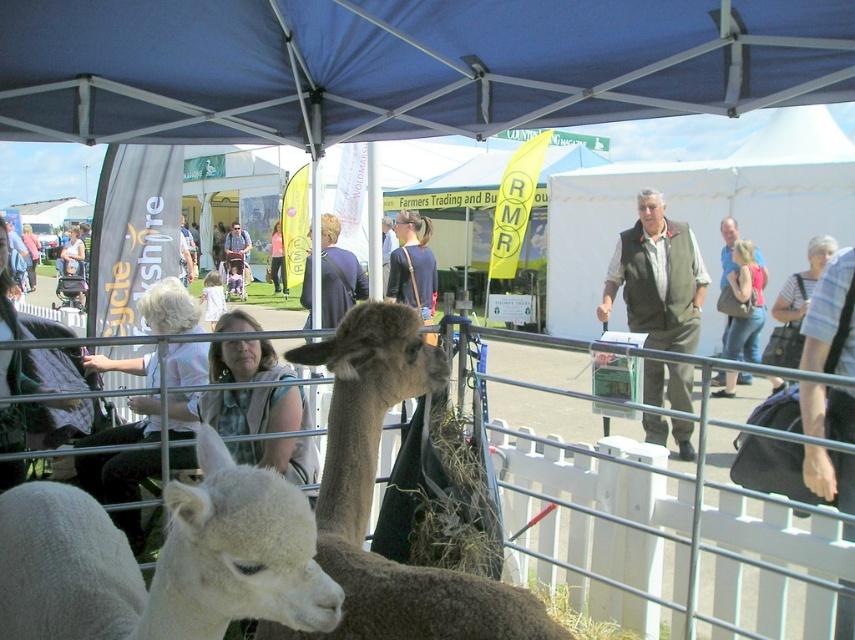
You are standing at the entrance of the fair and want to locate two specific points marked in the image. Which of the two points, point 1 at coordinates point [327,529] or point 2 at coordinates point [724,323], is closer to you?

Point 1 at coordinates point [327,529] is closer to the viewer than point 2 at coordinates point [724,323].

You are standing at the point marked by the coordinates point (602, 520). Which object is directly behind you?

The point (602, 520) is on the metal wire fence at center, so the metal wire fence at center is directly behind you.

You are a photographer at the fair and want to take a photo of both the brown woolen alpaca at center and the denim jacket at upper right. Which object should you focus on first to ensure both are in the frame?

The brown woolen alpaca at center is positioned on the left side of denim jacket at upper right, so you should focus on the brown woolen alpaca at center first to ensure both are in the frame.